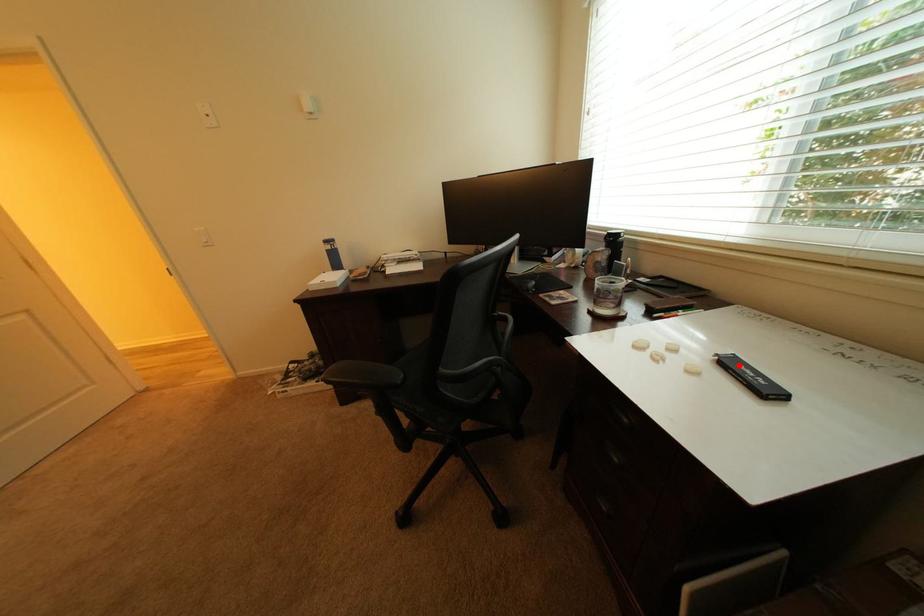
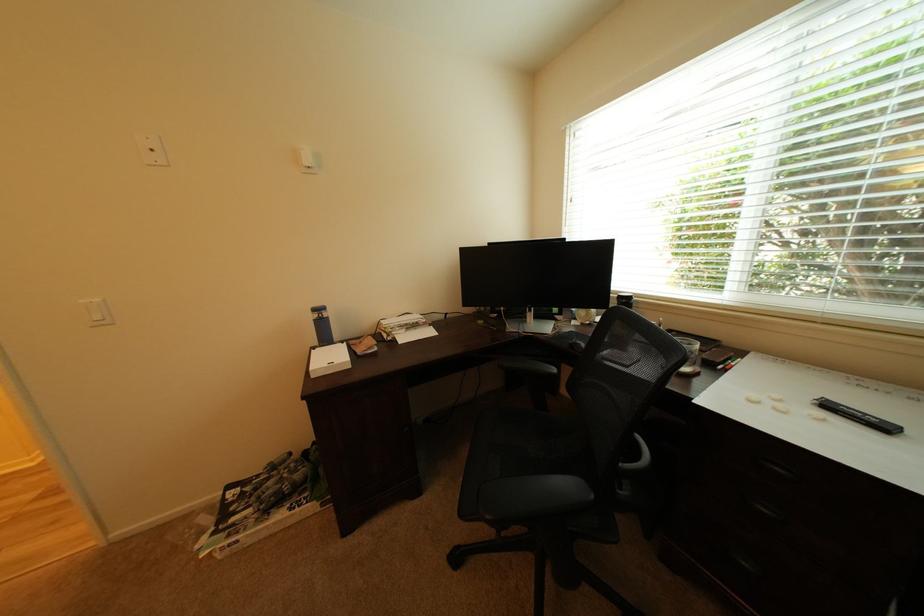
In the second image, find the point that corresponds to the highlighted location in the first image.

(840, 408)